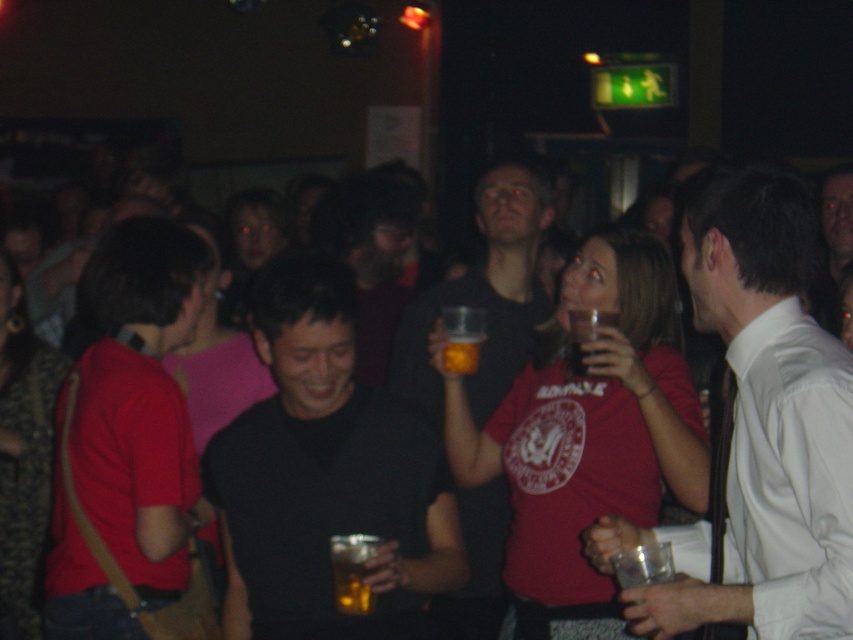
Is point (799, 276) farther from camera compared to point (357, 554)?

No, (799, 276) is in front of (357, 554).

Consider the image. Which is more to the right, white shirt at center or translucent amber liquid at center?

Positioned to the right is white shirt at center.

Is point (793, 486) farther from viewer compared to point (343, 554)?

No, (793, 486) is closer to viewer.

The image size is (853, 640). I want to click on white shirt at center, so click(x=758, y=429).

Is matte black shirt at center closer to camera compared to translucent plastic cup at upper center?

No, matte black shirt at center is further to the viewer.

Looking at this image, can you confirm if matte black shirt at center is positioned above translucent plastic cup at upper center?

Actually, matte black shirt at center is below translucent plastic cup at upper center.

The image size is (853, 640). What do you see at coordinates (483, 298) in the screenshot?
I see `matte black shirt at center` at bounding box center [483, 298].

Locate an element on the screen. matte black shirt at center is located at coordinates (483, 298).

Does black matte shirt at center have a smaller size compared to translucent glass beer at center?

Incorrect, black matte shirt at center is not smaller in size than translucent glass beer at center.

Is black matte shirt at center to the left of translucent glass beer at center from the viewer's perspective?

Correct, you'll find black matte shirt at center to the left of translucent glass beer at center.

The height and width of the screenshot is (640, 853). What do you see at coordinates (323, 474) in the screenshot? I see `black matte shirt at center` at bounding box center [323, 474].

You are a GUI agent. You are given a task and a screenshot of the screen. Output one action in this format:
    pyautogui.click(x=<x>, y=<y>)
    Task: Click on the black matte shirt at center
    The image size is (853, 640).
    Given the screenshot: What is the action you would take?
    pyautogui.click(x=323, y=474)